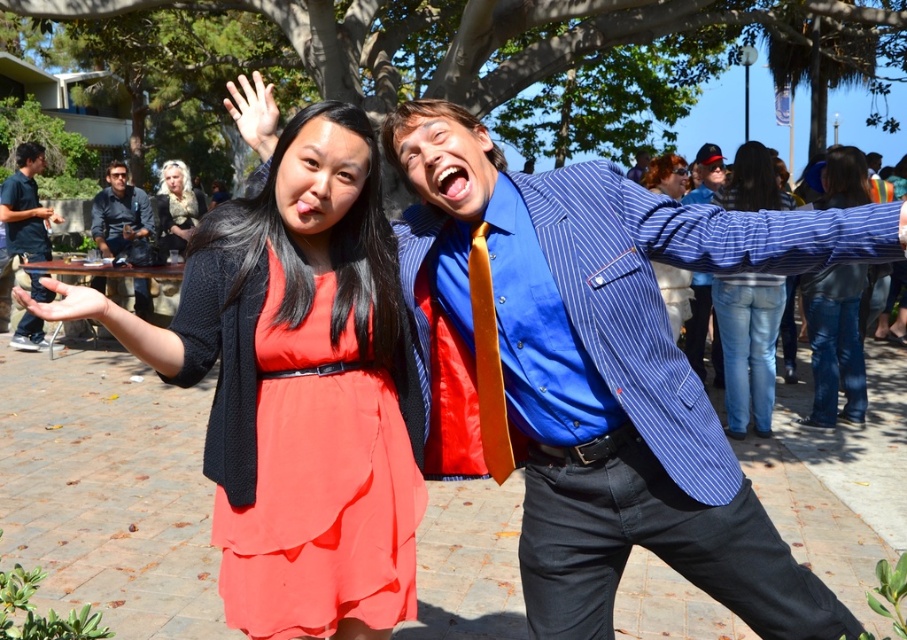
Looking at this image, you are taking a photo of two people in the scene. The first person is at point [774,326] and the second person is at point [841,276]. Which person is closer to the camera?

Point [774,326] is closer to the camera than point [841,276].

In the scene described, there are two people. One is wearing a coral satin dress at center and the other has matte black hair at upper center. Which of these two is positioned more to the left side of the image?

The coral satin dress at center is positioned to the left of the matte black hair at upper center, so the coral satin dress at center is more to the left.